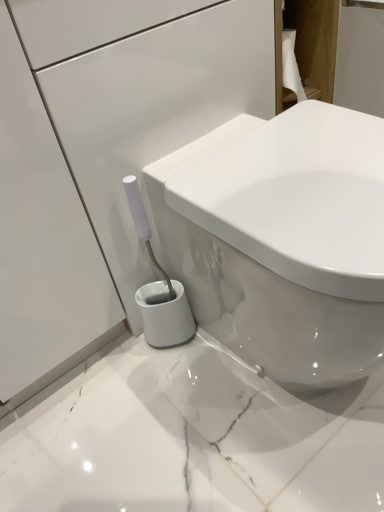
Where is `white glossy toilet at center`? white glossy toilet at center is located at coordinates (282, 240).

Image resolution: width=384 pixels, height=512 pixels. What do you see at coordinates (282, 240) in the screenshot?
I see `white glossy toilet at center` at bounding box center [282, 240].

Find the location of a particular element. The width and height of the screenshot is (384, 512). wooden cabinet at upper right is located at coordinates (308, 45).

The width and height of the screenshot is (384, 512). What do you see at coordinates (308, 45) in the screenshot?
I see `wooden cabinet at upper right` at bounding box center [308, 45].

Locate an element on the screen. white glossy toilet at center is located at coordinates (282, 240).

Considering the positions of objects white glossy toilet at center and wooden cabinet at upper right in the image provided, who is more to the right, white glossy toilet at center or wooden cabinet at upper right?

wooden cabinet at upper right is more to the right.

Is white glossy toilet at center closer to camera compared to wooden cabinet at upper right?

Yes, it is in front of wooden cabinet at upper right.

Considering the points (281, 348) and (316, 34), which point is behind, point (281, 348) or point (316, 34)?

The point (316, 34) is farther.

From the image's perspective, does white glossy toilet at center appear lower than wooden cabinet at upper right?

Correct, white glossy toilet at center appears lower than wooden cabinet at upper right in the image.

Consider the image. From a real-world perspective, between white glossy toilet at center and wooden cabinet at upper right, who is vertically higher?

wooden cabinet at upper right is physically above.

Looking at their sizes, would you say white glossy toilet at center is wider or thinner than wooden cabinet at upper right?

white glossy toilet at center is wider than wooden cabinet at upper right.

Between white glossy toilet at center and wooden cabinet at upper right, which one has less height?

wooden cabinet at upper right is shorter.

Is white glossy toilet at center smaller than wooden cabinet at upper right?

Actually, white glossy toilet at center might be larger than wooden cabinet at upper right.

Which is correct: white glossy toilet at center is inside wooden cabinet at upper right, or outside of it?

white glossy toilet at center exists outside the volume of wooden cabinet at upper right.

Is white glossy toilet at center beside wooden cabinet at upper right?

white glossy toilet at center and wooden cabinet at upper right are not in contact.

Is white glossy toilet at center facing towards wooden cabinet at upper right?

No, white glossy toilet at center does not turn towards wooden cabinet at upper right.

Can you tell me how much white glossy toilet at center and wooden cabinet at upper right differ in facing direction?

The angle between the facing direction of white glossy toilet at center and the facing direction of wooden cabinet at upper right is 0.4 degrees.

Measure the distance from white glossy toilet at center to wooden cabinet at upper right.

white glossy toilet at center is 16.45 inches from wooden cabinet at upper right.

Where is `cabinetry on the right of white glossy toilet at center`? This screenshot has height=512, width=384. cabinetry on the right of white glossy toilet at center is located at coordinates pos(308,45).

Can you confirm if wooden cabinet at upper right is positioned to the right of white glossy toilet at center?

Yes, wooden cabinet at upper right is to the right of white glossy toilet at center.

Which object is closer to the camera, wooden cabinet at upper right or white glossy toilet at center?

white glossy toilet at center.

Which is closer to the camera, (331, 68) or (302, 188)?

Point (331, 68) is positioned farther from the camera compared to point (302, 188).

From the image's perspective, relative to white glossy toilet at center, is wooden cabinet at upper right above or below?

From the image's perspective, wooden cabinet at upper right appears above white glossy toilet at center.

From a real-world perspective, between wooden cabinet at upper right and white glossy toilet at center, who is vertically lower?

white glossy toilet at center.

Is wooden cabinet at upper right wider or thinner than white glossy toilet at center?

In the image, wooden cabinet at upper right appears to be more narrow than white glossy toilet at center.

Which of these two, wooden cabinet at upper right or white glossy toilet at center, stands shorter?

wooden cabinet at upper right.

Which of these two, wooden cabinet at upper right or white glossy toilet at center, is smaller?

wooden cabinet at upper right.

Is wooden cabinet at upper right located outside white glossy toilet at center?

Yes, wooden cabinet at upper right is located beyond the bounds of white glossy toilet at center.

Is wooden cabinet at upper right far away from white glossy toilet at center?

wooden cabinet at upper right is near white glossy toilet at center, not far away.

Could you tell me if wooden cabinet at upper right is facing white glossy toilet at center?

No.

Can you tell me how much wooden cabinet at upper right and white glossy toilet at center differ in facing direction?

wooden cabinet at upper right and white glossy toilet at center are facing 0.4 degrees away from each other.

The width and height of the screenshot is (384, 512). Find the location of `cabinetry above the white glossy toilet at center (from a real-world perspective)`. cabinetry above the white glossy toilet at center (from a real-world perspective) is located at coordinates (308, 45).

Locate an element on the screen. This screenshot has width=384, height=512. toilet that appears below the wooden cabinet at upper right (from the image's perspective) is located at coordinates (282, 240).

In order to click on cabinetry located behind the white glossy toilet at center in this screenshot , I will do `click(308, 45)`.